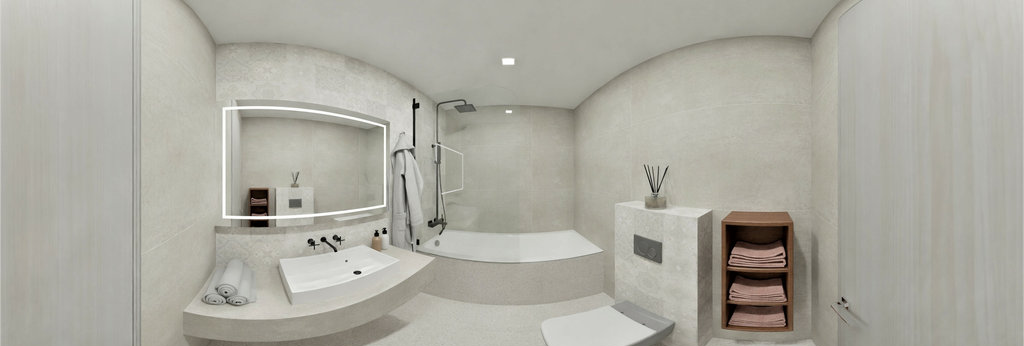
The image size is (1024, 346). In order to click on ceiling in this screenshot , I will do `click(524, 56)`.